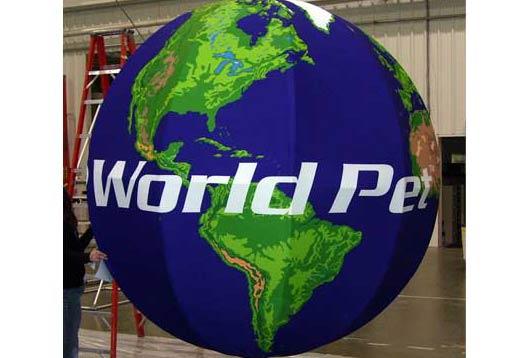
This screenshot has width=525, height=358. What are the coordinates of `globe` in the screenshot? It's located at (299, 120).